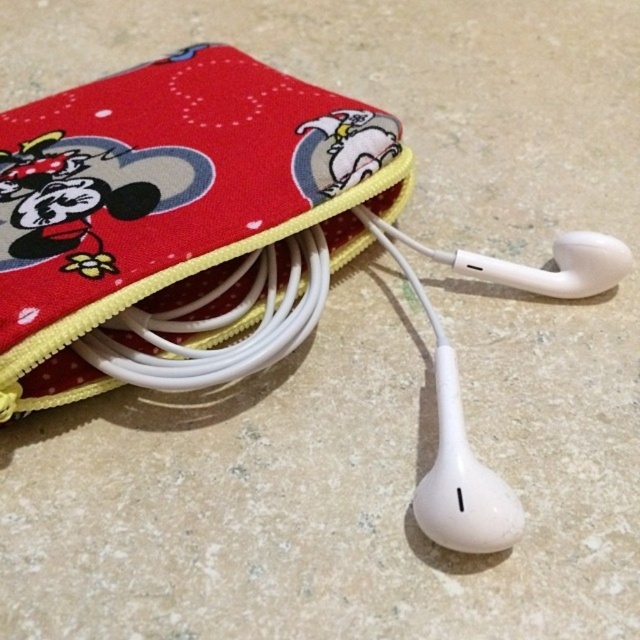
Who is more distant from viewer, (83, 209) or (413, 285)?

The point (413, 285) is behind.

Which of these two, matte fabric pouch at upper left or white matte earphones at center, stands taller?

With more height is matte fabric pouch at upper left.

Is point (118, 268) farther from viewer compared to point (458, 493)?

Yes.

This screenshot has width=640, height=640. I want to click on matte fabric pouch at upper left, so click(x=177, y=220).